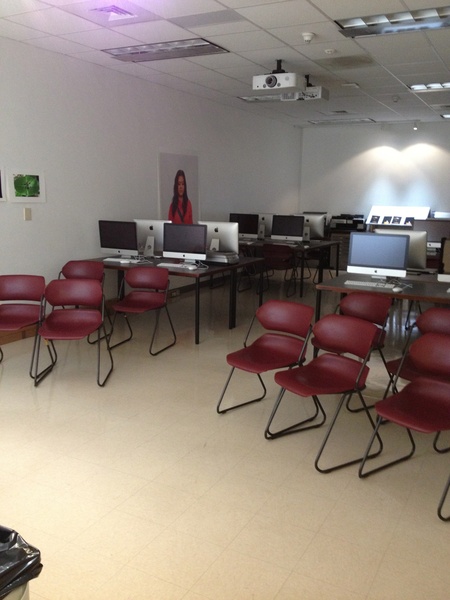
Image resolution: width=450 pixels, height=600 pixels. In order to click on light in this screenshot , I will do `click(427, 23)`.